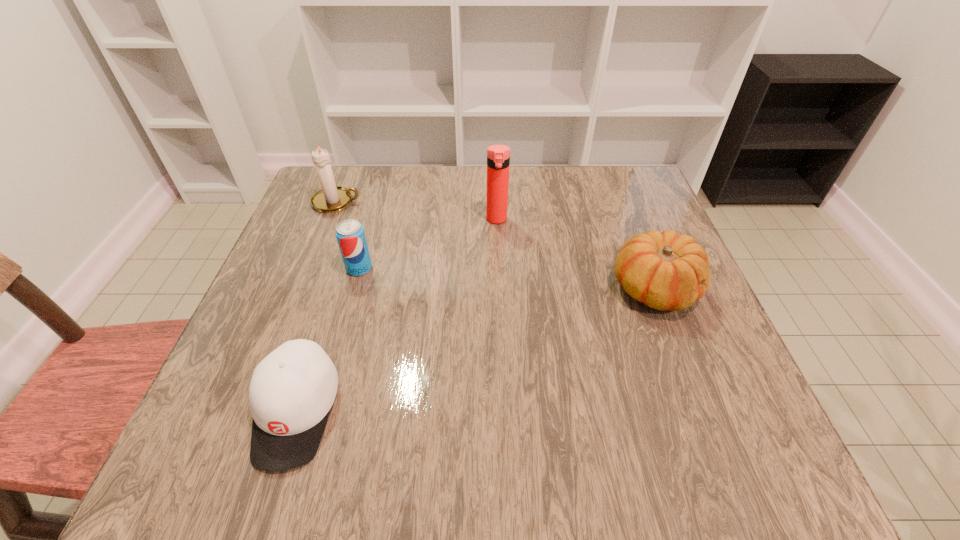
This screenshot has width=960, height=540. I want to click on vacant area at the left edge of the desktop, so click(244, 395).

I want to click on vacant region at the right edge of the desktop, so click(x=680, y=421).

In the image, there is a desktop. Identify the location of free region at the near right corner. (753, 476).

This screenshot has height=540, width=960. In order to click on unoccupied position between the gourd and the baseball cap in this screenshot , I will do `click(475, 350)`.

I want to click on vacant area that lies between the thermos bottle and the soda can, so click(x=428, y=244).

Image resolution: width=960 pixels, height=540 pixels. Identify the location of empty space that is in between the candle holder and the nearest object. (317, 307).

You are a GUI agent. You are given a task and a screenshot of the screen. Output one action in this format:
    pyautogui.click(x=<x>, y=<y>)
    Task: Click on the vacant space that is in between the soda can and the baseball cap
    The height and width of the screenshot is (540, 960).
    Given the screenshot: What is the action you would take?
    pyautogui.click(x=328, y=340)

The image size is (960, 540). What are the coordinates of `vacant space that's between the candle holder and the thermos bottle` in the screenshot? It's located at (417, 211).

Find the location of `empty space that is in between the soda can and the gourd`. empty space that is in between the soda can and the gourd is located at coordinates (507, 279).

At what (x,y) coordinates should I click in order to perform the action: click on free space between the baseball cap and the rightmost object. Please return your answer as a coordinate pair (x, y). Looking at the image, I should click on [475, 350].